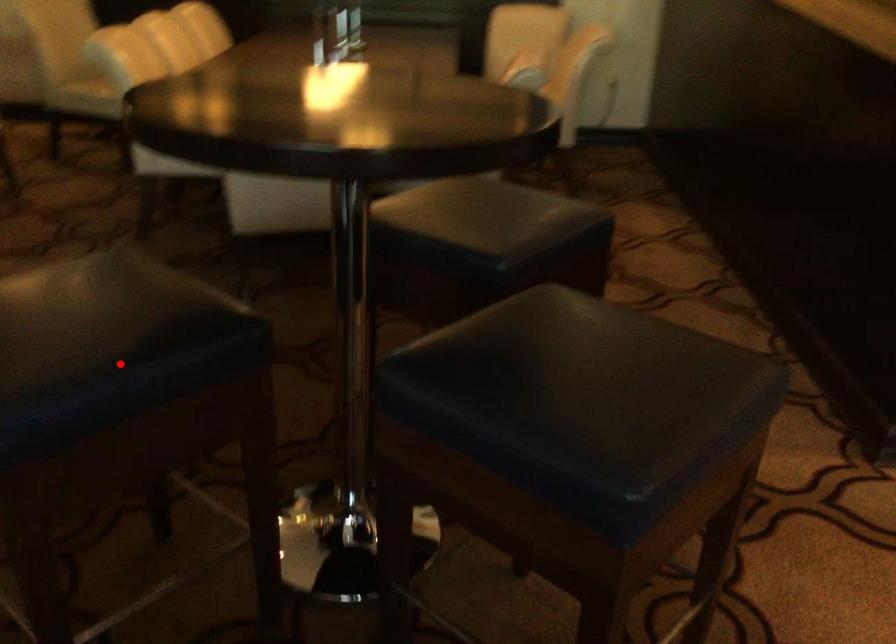
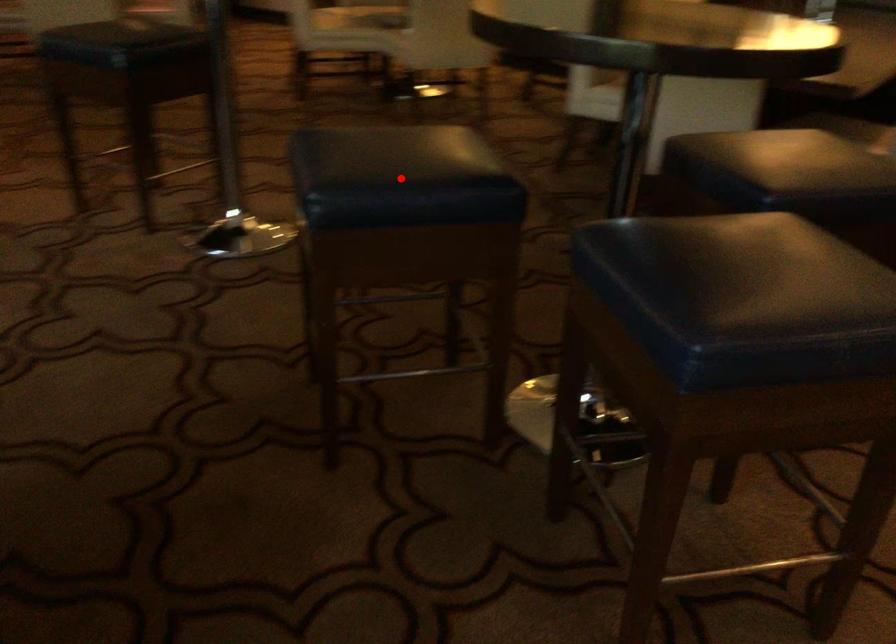
I am providing you with two images of the same scene from different viewpoints. A red point is marked on the first image and another point is marked on the second image. Is the marked point in image1 the same physical position as the marked point in image2?

Yes